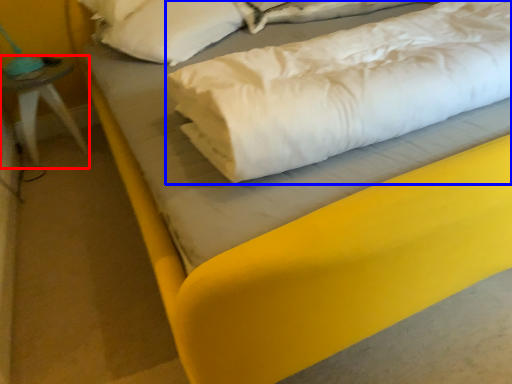
Question: Which of the following is the closest to the observer, furniture (highlighted by a red box) or linen (highlighted by a blue box)?

Choices:
 (A) furniture
 (B) linen

Answer: (B)